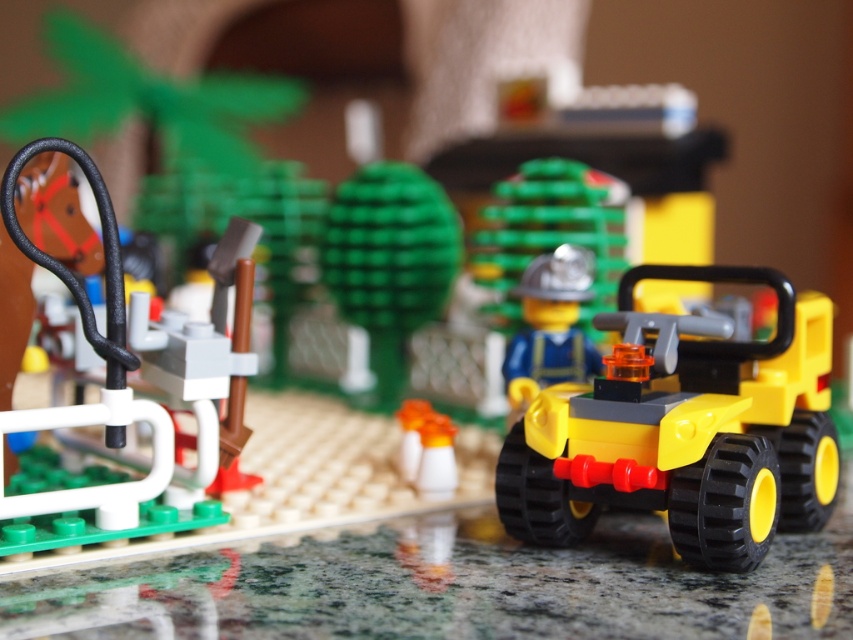
Question: Does yellow plastic atv at center-right have a larger size compared to blue matte figure at center?

Choices:
 (A) yes
 (B) no

Answer: (A)

Question: Considering the real-world distances, which object is closest to the black rubber hose at left?

Choices:
 (A) blue matte figure at center
 (B) yellow plastic atv at center-right

Answer: (B)

Question: Can you confirm if yellow plastic atv at center-right is thinner than blue matte figure at center?

Choices:
 (A) no
 (B) yes

Answer: (A)

Question: Which object appears closest to the camera in this image?

Choices:
 (A) yellow plastic atv at center-right
 (B) black rubber hose at left
 (C) blue matte figure at center

Answer: (B)

Question: Does yellow plastic atv at center-right have a greater width compared to black rubber hose at left?

Choices:
 (A) no
 (B) yes

Answer: (B)

Question: Which point is closer to the camera taking this photo?

Choices:
 (A) (32, 156)
 (B) (660, 468)

Answer: (A)